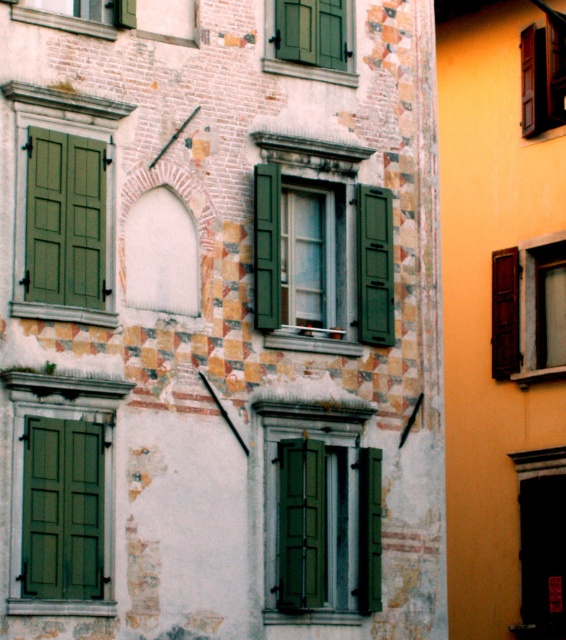
The height and width of the screenshot is (640, 566). I want to click on green matte window at center, so click(x=319, y=513).

Between green matte window at center and green matte shutter at center, which one is positioned higher?

Positioned higher is green matte shutter at center.

Which is behind, point (307, 406) or point (370, 339)?

The point (370, 339) is behind.

Identify the location of green matte window at center. click(319, 513).

Does point (499, 346) come in front of point (114, 3)?

That is False.

Which is in front, point (555, 248) or point (93, 13)?

Point (93, 13) is more forward.

The width and height of the screenshot is (566, 640). Identify the location of wooden shutters at right. (529, 307).

Is point (530, 128) closer to viewer compared to point (36, 4)?

That is False.

Between wooden window at upper right and green wooden window at upper left, which one appears on the right side from the viewer's perspective?

wooden window at upper right

Does point (524, 49) come farther from viewer compared to point (70, 12)?

Yes, point (524, 49) is farther from viewer.

I want to click on wooden window at upper right, so click(542, 72).